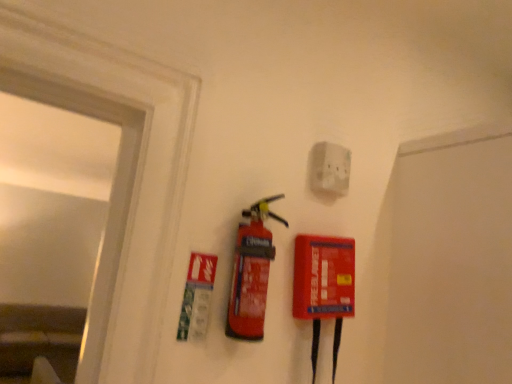
Question: Can you confirm if red matte fire extinguisher at center is taller than white matte electric outlet at upper center?

Choices:
 (A) yes
 (B) no

Answer: (A)

Question: Is red matte fire extinguisher at center outside of white matte electric outlet at upper center?

Choices:
 (A) no
 (B) yes

Answer: (B)

Question: Considering the relative positions of red matte fire extinguisher at center and white matte electric outlet at upper center in the image provided, is red matte fire extinguisher at center to the right of white matte electric outlet at upper center from the viewer's perspective?

Choices:
 (A) yes
 (B) no

Answer: (B)

Question: Can you confirm if red matte fire extinguisher at center is positioned to the left of white matte electric outlet at upper center?

Choices:
 (A) no
 (B) yes

Answer: (B)

Question: Is red matte fire extinguisher at center wider than white matte electric outlet at upper center?

Choices:
 (A) no
 (B) yes

Answer: (B)

Question: Is red matte fire extinguisher at center facing away from white matte electric outlet at upper center?

Choices:
 (A) no
 (B) yes

Answer: (A)

Question: Considering the relative positions of white matte electric outlet at upper center and red matte fire extinguisher at center in the image provided, is white matte electric outlet at upper center to the left of red matte fire extinguisher at center from the viewer's perspective?

Choices:
 (A) no
 (B) yes

Answer: (A)

Question: Is the surface of white matte electric outlet at upper center in direct contact with red matte fire extinguisher at center?

Choices:
 (A) yes
 (B) no

Answer: (B)

Question: Does white matte electric outlet at upper center have a lesser width compared to red matte fire extinguisher at center?

Choices:
 (A) yes
 (B) no

Answer: (A)

Question: Does white matte electric outlet at upper center have a greater width compared to red matte fire extinguisher at center?

Choices:
 (A) no
 (B) yes

Answer: (A)

Question: From the image's perspective, is white matte electric outlet at upper center beneath red matte fire extinguisher at center?

Choices:
 (A) yes
 (B) no

Answer: (B)

Question: Is white matte electric outlet at upper center positioned before red matte fire extinguisher at center?

Choices:
 (A) yes
 (B) no

Answer: (B)

Question: Is red matte fire extinguisher at center wider or thinner than white matte electric outlet at upper center?

Choices:
 (A) wide
 (B) thin

Answer: (A)